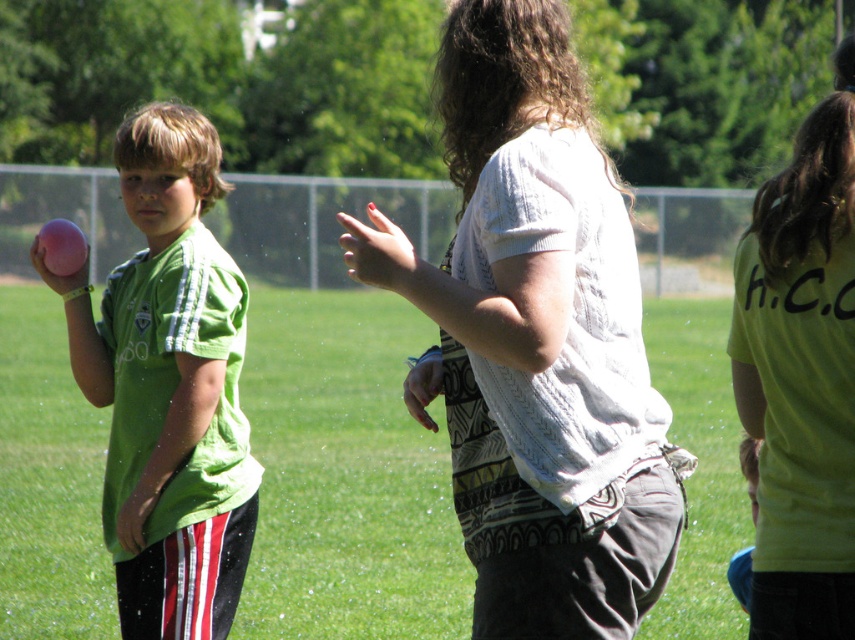
You are a photographer at the park and want to capture a photo of the white knitted sweater at center and the matte pink ball at left. Which object is positioned higher in the frame?

The white knitted sweater at center is positioned higher in the frame than the matte pink ball at left.

You are standing at the point marked as point (237,278) and want to walk to the point marked as point (531,113). Which direction should you move to get closer to your destination?

You should move towards the point marked as point (531,113), which is closer to the camera than point (237,278). Since the destination is closer to the camera, you should move forward towards it.